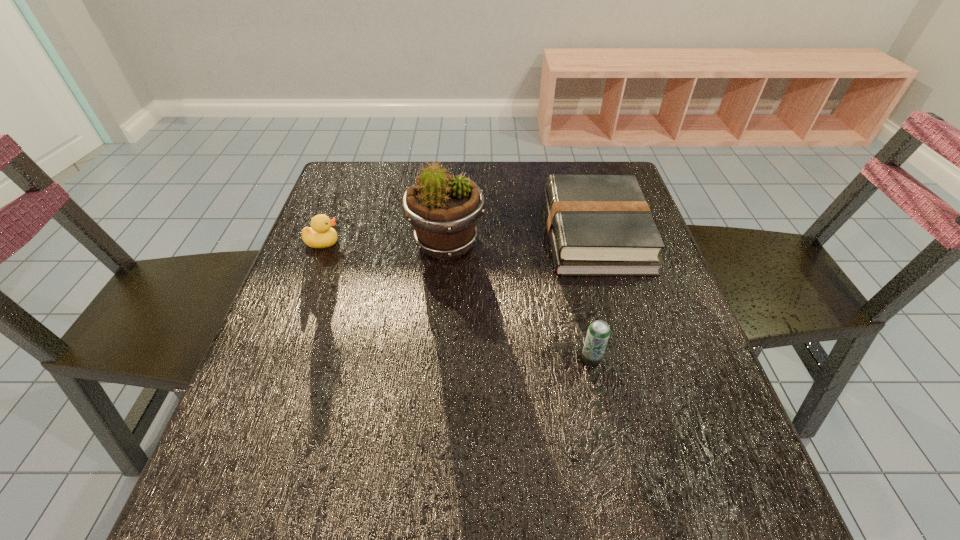
The height and width of the screenshot is (540, 960). In order to click on vacant space located 0.060m on the face of the leftmost object in this screenshot , I will do `click(365, 242)`.

You are a GUI agent. You are given a task and a screenshot of the screen. Output one action in this format:
    pyautogui.click(x=<x>, y=<y>)
    Task: Click on the object at the far edge
    Image resolution: width=960 pixels, height=540 pixels.
    Given the screenshot: What is the action you would take?
    pyautogui.click(x=599, y=225)

This screenshot has width=960, height=540. I want to click on object that is at the left edge, so (320, 235).

Locate an element on the screen. This screenshot has width=960, height=540. object located in the right edge section of the desktop is located at coordinates (599, 225).

Where is `object present at the far right corner`? This screenshot has height=540, width=960. object present at the far right corner is located at coordinates (599, 225).

Locate an element on the screen. Image resolution: width=960 pixels, height=540 pixels. free region at the far edge is located at coordinates (540, 199).

At what (x,y) coordinates should I click in order to perform the action: click on vacant space at the near edge of the desktop. Please return your answer as a coordinate pair (x, y). The height and width of the screenshot is (540, 960). Looking at the image, I should click on (405, 474).

Where is `free space at the left edge of the desktop`? free space at the left edge of the desktop is located at coordinates (298, 330).

Find the location of a particular element. This screenshot has width=960, height=540. vacant space at the right edge of the desktop is located at coordinates (631, 281).

Locate an element on the screen. free point at the far left corner is located at coordinates (369, 178).